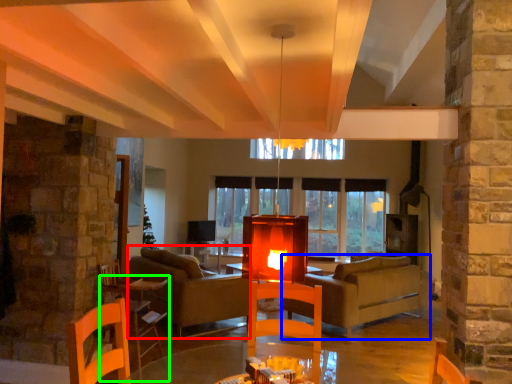
Question: Based on their relative distances, which object is farther from couch (highlighted by a red box)? Choose from studio couch (highlighted by a blue box) and table (highlighted by a green box).

Choices:
 (A) studio couch
 (B) table

Answer: (A)